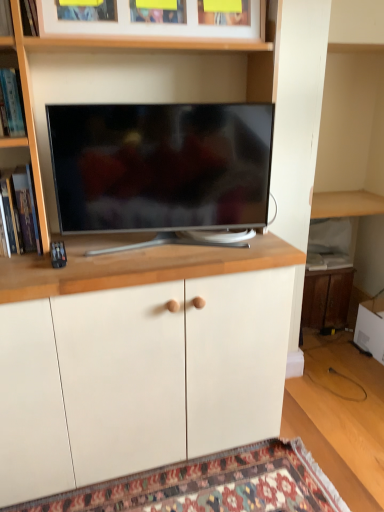
Identify the location of free spot above carpeted mat at lower center (from a real-world perspective). The width and height of the screenshot is (384, 512). (226, 486).